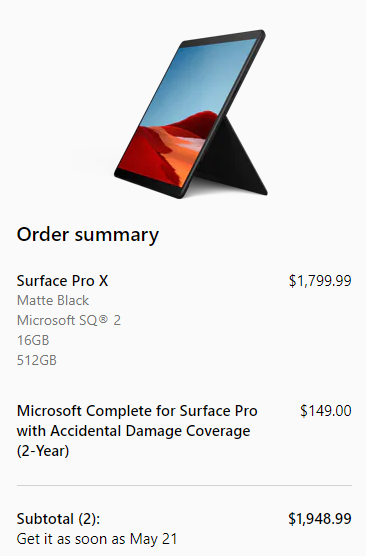
The width and height of the screenshot is (366, 556). I want to click on surface, so click(x=54, y=279).